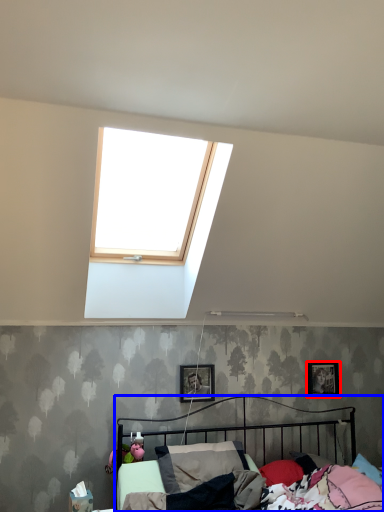
Question: Which object appears farthest to the camera in this image, picture frame (highlighted by a red box) or bed (highlighted by a blue box)?

Choices:
 (A) picture frame
 (B) bed

Answer: (A)